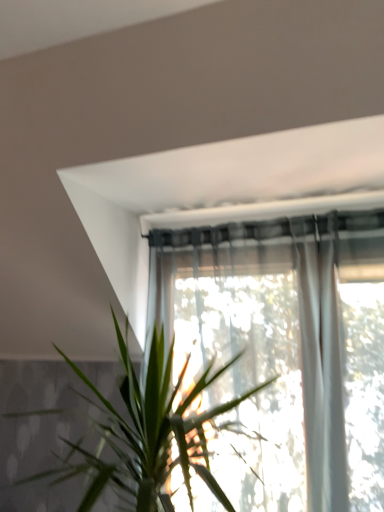
Question: Should I look upward or downward to see green leafy plant at center?

Choices:
 (A) up
 (B) down

Answer: (B)